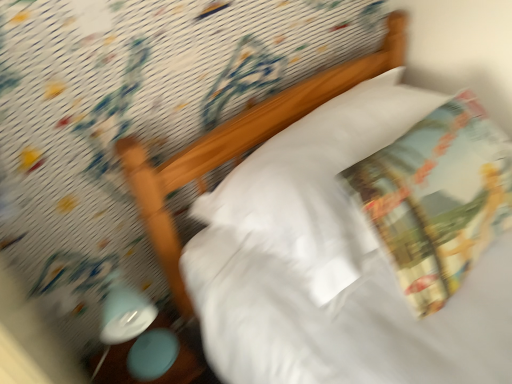
You are a GUI agent. You are given a task and a screenshot of the screen. Output one action in this format:
    pyautogui.click(x=<x>, y=<y>)
    Task: Click on the vacant region above matte plastic table at lower left (from a real-world perspective)
    The width and height of the screenshot is (512, 384).
    Given the screenshot: What is the action you would take?
    pyautogui.click(x=151, y=358)